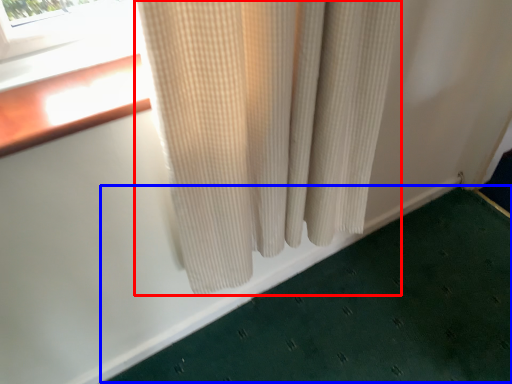
Question: Among these objects, which one is nearest to the camera, curtain (highlighted by a red box) or bath mat (highlighted by a blue box)?

Choices:
 (A) curtain
 (B) bath mat

Answer: (A)